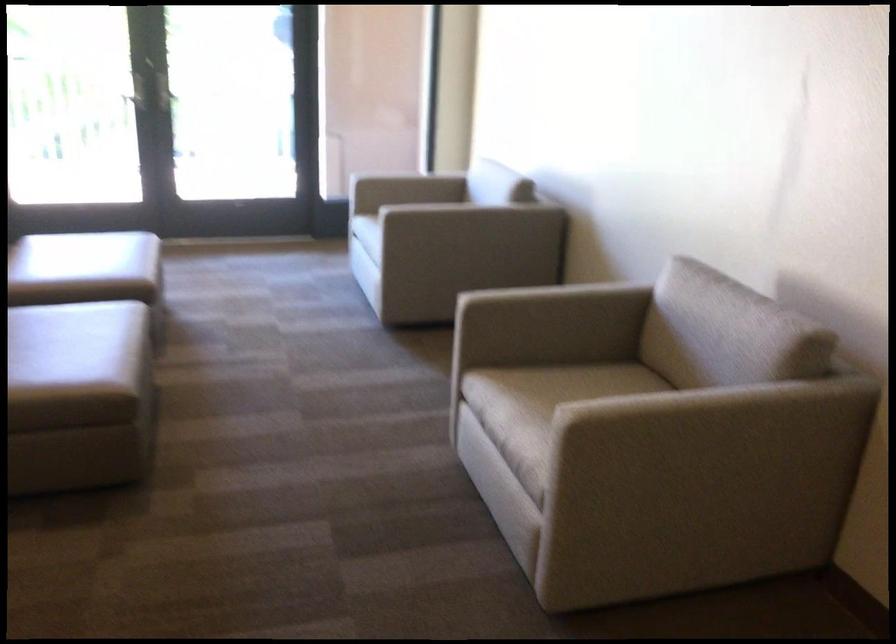
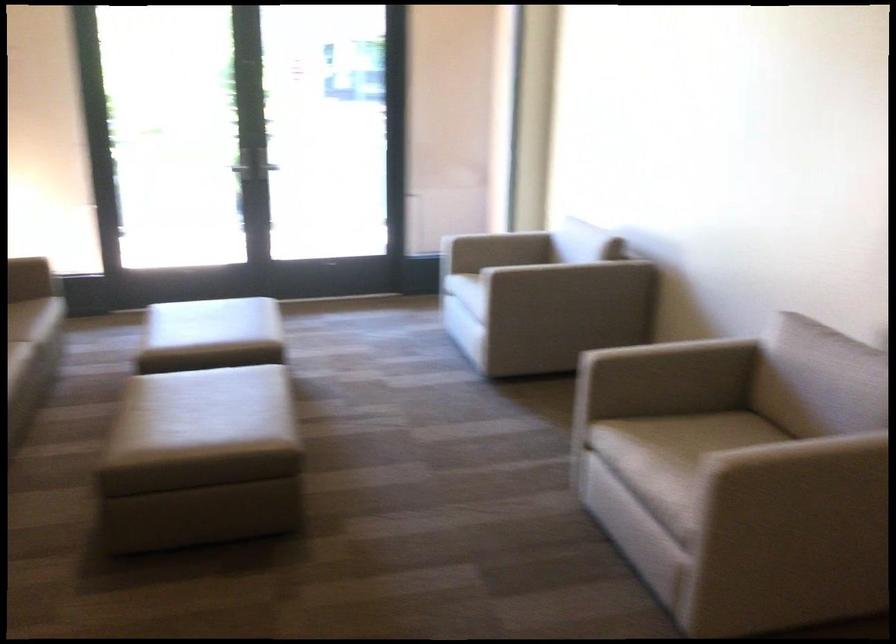
Question: The images are taken continuously from a first-person perspective. In which direction is your viewpoint rotating?

Choices:
 (A) Left
 (B) Right
 (C) Up
 (D) Down

Answer: (C)